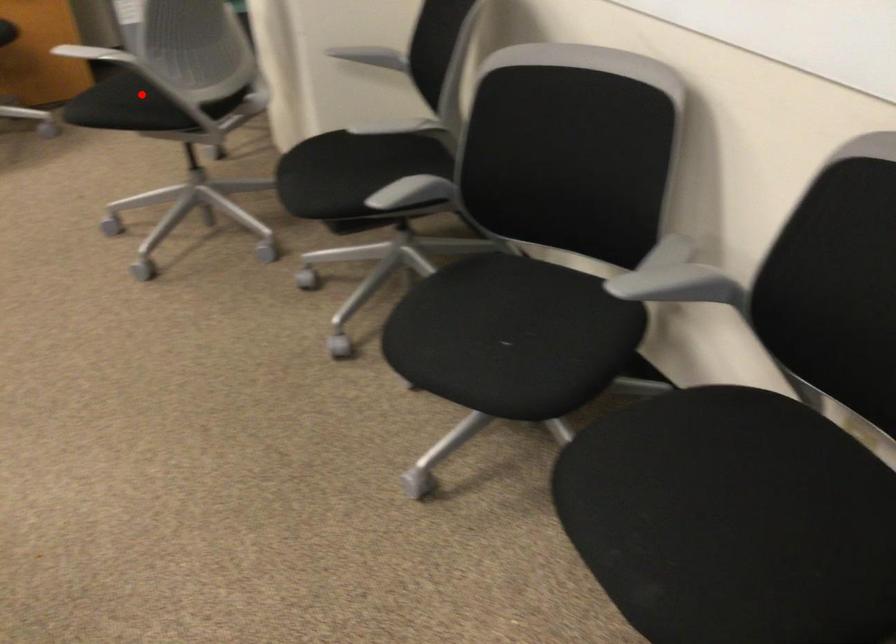
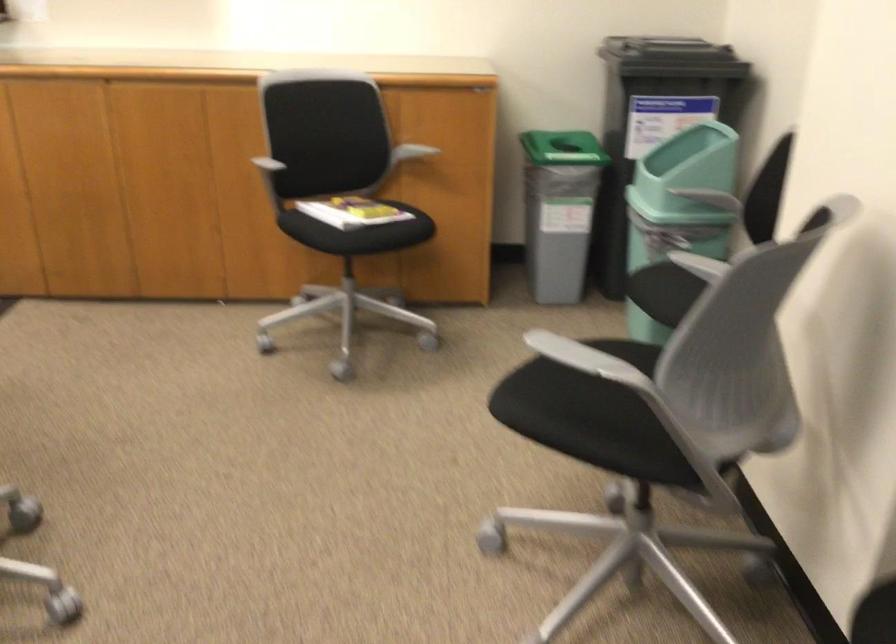
Locate, in the second image, the point that corresponds to the highlighted location in the first image.

(599, 406)